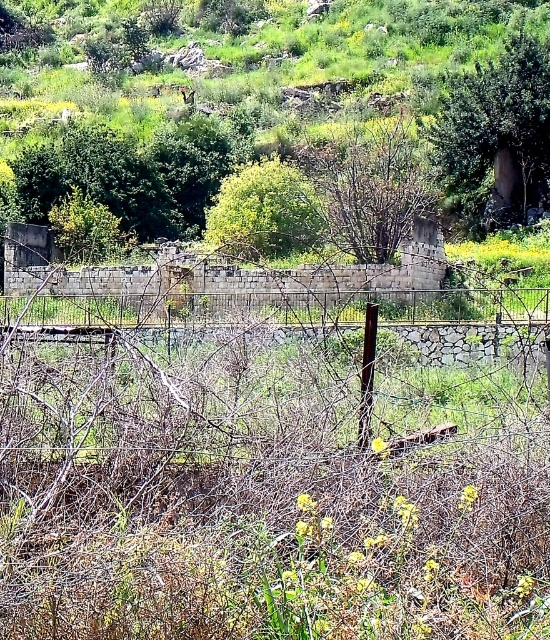
Image resolution: width=550 pixels, height=640 pixels. What do you see at coordinates (371, 186) in the screenshot?
I see `bare branches at center` at bounding box center [371, 186].

Can you confirm if bare branches at center is positioned above green leafy tree at center?

Yes.

Which is behind, point (387, 179) or point (251, 216)?

The point (387, 179) is behind.

Where is `bare branches at center`? bare branches at center is located at coordinates (371, 186).

Who is more distant from viewer, (522, 145) or (231, 189)?

Point (522, 145)

Is green leafy tree at upper right above green leafy tree at center?

Correct, green leafy tree at upper right is located above green leafy tree at center.

Does point (481, 189) lie behind point (207, 232)?

Yes, it is.

This screenshot has height=640, width=550. Find the location of `green leafy tree at upper right`. green leafy tree at upper right is located at coordinates (496, 134).

Which is in front, point (481, 122) or point (393, 129)?

Point (481, 122)

Between green leafy tree at upper right and bare branches at center, which one has more height?

Standing taller between the two is green leafy tree at upper right.

At what (x,y) coordinates should I click in order to perform the action: click on green leafy tree at upper right. Please return your answer as a coordinate pair (x, y). The height and width of the screenshot is (640, 550). Looking at the image, I should click on (496, 134).